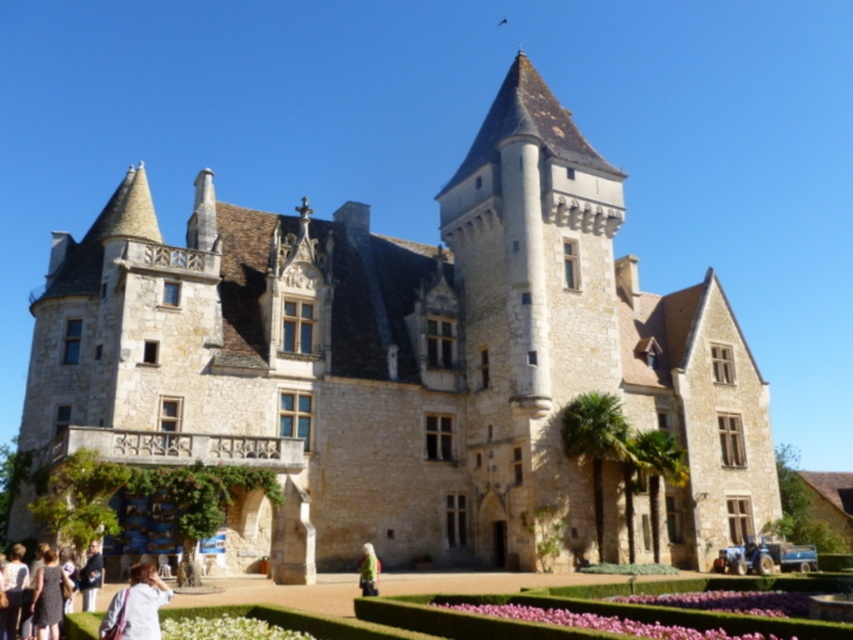
Can you confirm if dark brown leather jacket at lower left is positioned to the right of white cotton shirt at lower left?

Indeed, dark brown leather jacket at lower left is positioned on the right side of white cotton shirt at lower left.

Is point (42, 582) positioned before point (0, 554)?

Yes, it is.

Describe the element at coordinates (49, 596) in the screenshot. I see `dark brown leather jacket at lower left` at that location.

You are a GUI agent. You are given a task and a screenshot of the screen. Output one action in this format:
    pyautogui.click(x=<x>, y=<y>)
    Task: Click on the dark brown leather jacket at lower left
    The width and height of the screenshot is (853, 640).
    Given the screenshot: What is the action you would take?
    pyautogui.click(x=49, y=596)

Between point (128, 621) and point (364, 564), which one is positioned behind?

The point (364, 564) is behind.

Describe the element at coordinates (136, 605) in the screenshot. This screenshot has width=853, height=640. I see `white fabric at lower left` at that location.

Find the location of `white fabric at lower left`. white fabric at lower left is located at coordinates (136, 605).

How much distance is there between light brown leather jacket at lower left and white cotton shirt at lower left?

3.81 meters

Between light brown leather jacket at lower left and white cotton shirt at lower left, which one is positioned higher?

white cotton shirt at lower left is above.

Who is more forward, (90, 566) or (0, 611)?

Point (0, 611)

You are a GUI agent. You are given a task and a screenshot of the screen. Output one action in this format:
    pyautogui.click(x=<x>, y=<y>)
    Task: Click on the light brown leather jacket at lower left
    The width and height of the screenshot is (853, 640).
    Given the screenshot: What is the action you would take?
    pyautogui.click(x=90, y=577)